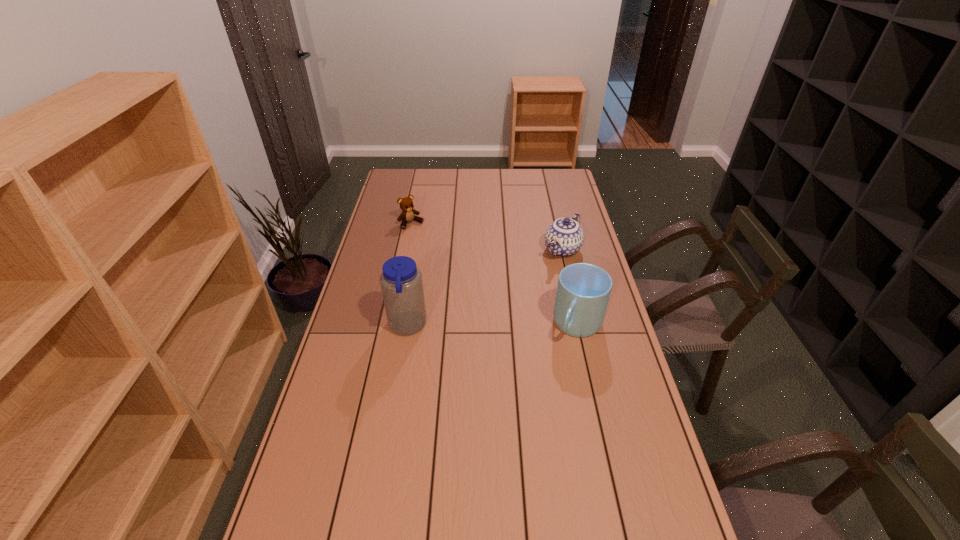
This screenshot has height=540, width=960. Find the location of `the tallest object`. the tallest object is located at coordinates (401, 282).

Find the location of a particular element. mug is located at coordinates (583, 291).

You are a GUI agent. You are given a task and a screenshot of the screen. Output one action in this format:
    pyautogui.click(x=<x>, y=<y>)
    Task: Click on the third tallest object
    This screenshot has height=540, width=960.
    Given the screenshot: What is the action you would take?
    pyautogui.click(x=564, y=237)

This screenshot has width=960, height=540. Identify the location of chinaware. (564, 237).

Locate an element on the screen. Image resolution: width=960 pixels, height=540 pixels. the shortest object is located at coordinates (408, 214).

At what (x,y) coordinates should I click in order to perform the action: click on teddy bear. Please return your answer as a coordinate pair (x, y). The width and height of the screenshot is (960, 540). Looking at the image, I should click on (408, 214).

Identify the location of vacant region located 0.060m with a carrying loop on the side of the tallest object. (370, 326).

In order to click on free region located 0.070m with a carrying loop on the side of the tallest object in this screenshot , I will do 367,326.

At what (x,y) coordinates should I click in order to perform the action: click on free space located 0.110m with a carrying loop on the side of the tallest object. Please return your answer as a coordinate pair (x, y). Image resolution: width=960 pixels, height=540 pixels. Looking at the image, I should click on (355, 326).

The image size is (960, 540). Find the location of `blank area located 0.100m on the front of the third shortest object`. blank area located 0.100m on the front of the third shortest object is located at coordinates (589, 375).